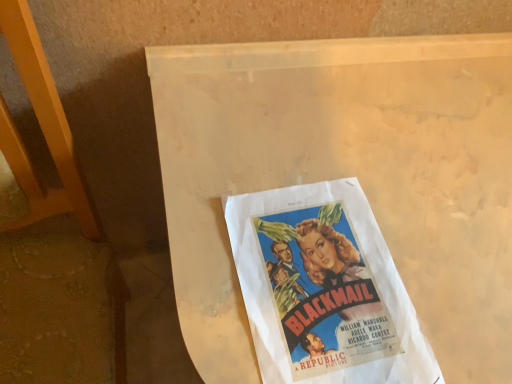
The height and width of the screenshot is (384, 512). In order to click on free spot below vintage paper poster at center (from a real-world perspective) in this screenshot , I will do `click(318, 288)`.